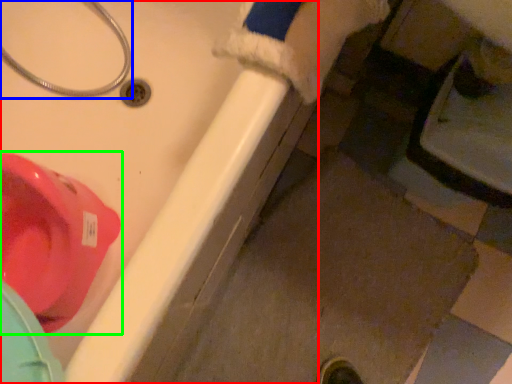
Question: Which object is positioned farthest from bath (highlighted by a red box)? Select from plumbing fixture (highlighted by a blue box) and toilet (highlighted by a green box).

Choices:
 (A) plumbing fixture
 (B) toilet

Answer: (A)